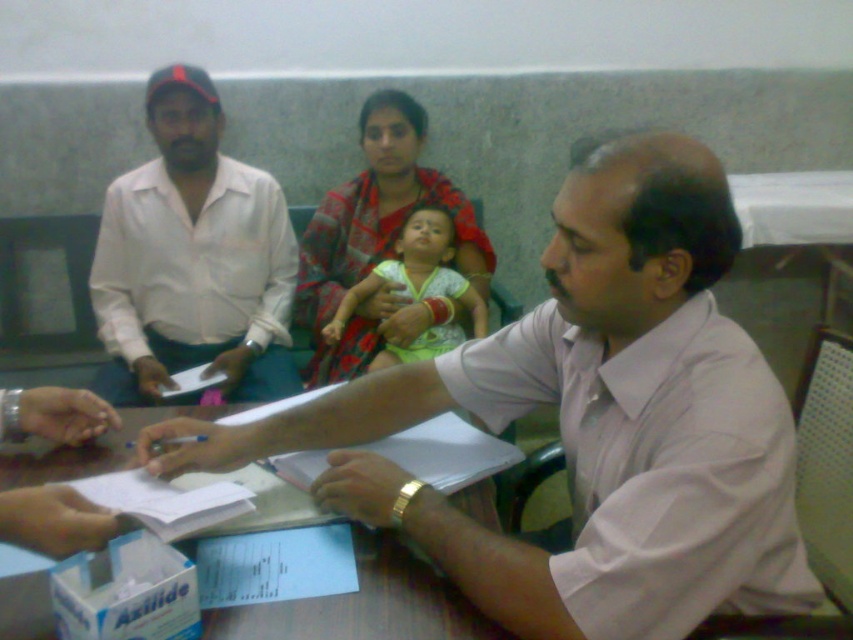
Between white paper at center and light green fabric baby at center, which one is positioned higher?

Positioned higher is light green fabric baby at center.

Who is more distant from viewer, [184,410] or [344,323]?

Positioned behind is point [344,323].

Find the location of a particular element. This screenshot has height=640, width=853. white paper at center is located at coordinates (363, 605).

How much distance is there between pink fabric shirt at center and light green fabric baby at center?

pink fabric shirt at center and light green fabric baby at center are 1.06 meters apart from each other.

Does pink fabric shirt at center have a greater width compared to light green fabric baby at center?

Yes.

I want to click on pink fabric shirt at center, so click(589, 420).

Where is `pink fabric shirt at center`? This screenshot has width=853, height=640. pink fabric shirt at center is located at coordinates (589, 420).

Is white cotton shirt at left to the left of white paper at center from the viewer's perspective?

Indeed, white cotton shirt at left is positioned on the left side of white paper at center.

This screenshot has height=640, width=853. What do you see at coordinates (193, 259) in the screenshot? I see `white cotton shirt at left` at bounding box center [193, 259].

Between point (131, 301) and point (241, 636), which one is positioned behind?

Point (131, 301)

Locate an element on the screen. The image size is (853, 640). white cotton shirt at left is located at coordinates (193, 259).